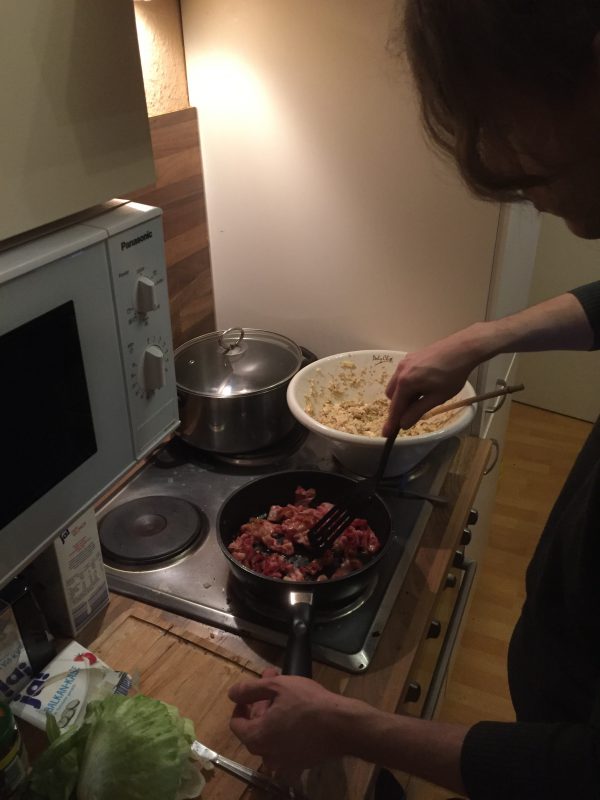
Find the location of `black cooking serface`. black cooking serface is located at coordinates (176, 538).